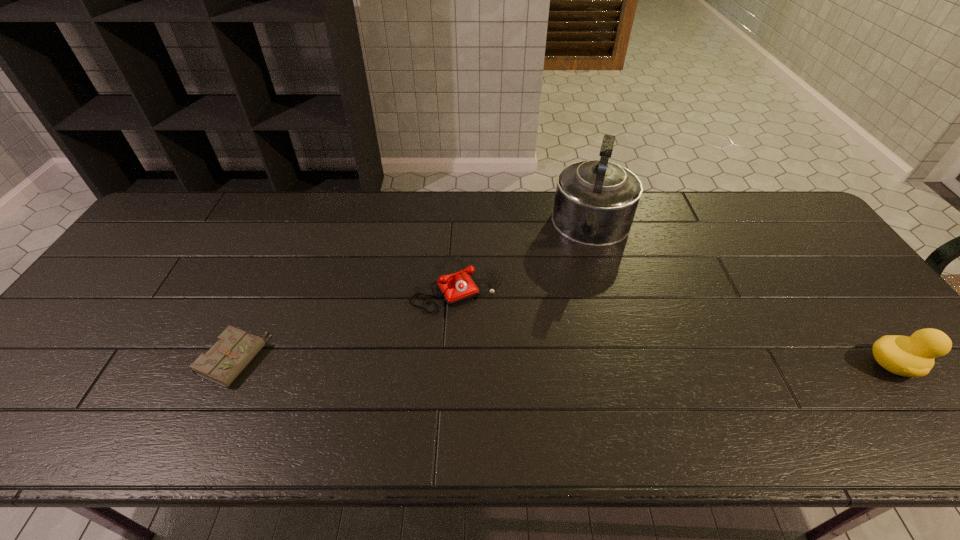
Image resolution: width=960 pixels, height=540 pixels. I want to click on free space on the desktop that is between the leftmost object and the third shortest object and is positioned with the spout at the front of the kettle, so click(563, 362).

You are a GUI agent. You are given a task and a screenshot of the screen. Output one action in this format:
    pyautogui.click(x=<x>, y=<y>)
    Task: Click on the vacant space on the desktop that is between the leftmost object and the duck and is positioned on the dial of the third object from right to left
    
    Given the screenshot: What is the action you would take?
    pyautogui.click(x=505, y=362)